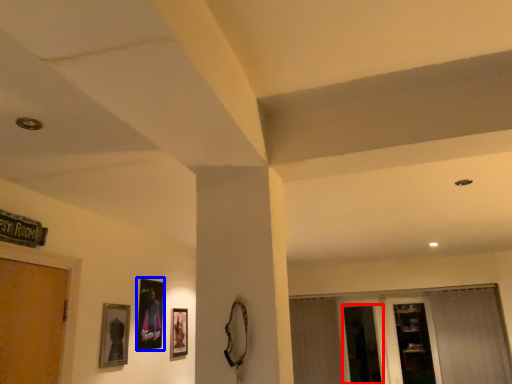
Question: Which point is further to the camera, screen door (highlighted by a red box) or picture frame (highlighted by a blue box)?

Choices:
 (A) screen door
 (B) picture frame

Answer: (A)